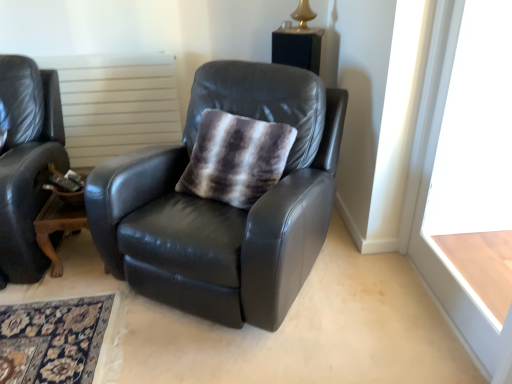
Question: From their relative heights in the image, would you say matte black leather chair at center is taller or shorter than white wood window frame at right?

Choices:
 (A) tall
 (B) short

Answer: (B)

Question: Based on their sizes in the image, would you say matte black leather chair at center is bigger or smaller than white wood window frame at right?

Choices:
 (A) small
 (B) big

Answer: (B)

Question: Based on their relative distances, which object is farther from the fuzzy brown and white throw pillow at center?

Choices:
 (A) white wood window frame at right
 (B) matte black leather chair at center
 (C) brown wooden table at lower left
 (D) white textured radiator at upper center

Answer: (D)

Question: Estimate the real-world distances between objects in this image. Which object is closer to the brown wooden table at lower left?

Choices:
 (A) white wood window frame at right
 (B) fuzzy brown and white throw pillow at center
 (C) white textured radiator at upper center
 (D) matte black leather chair at center

Answer: (D)